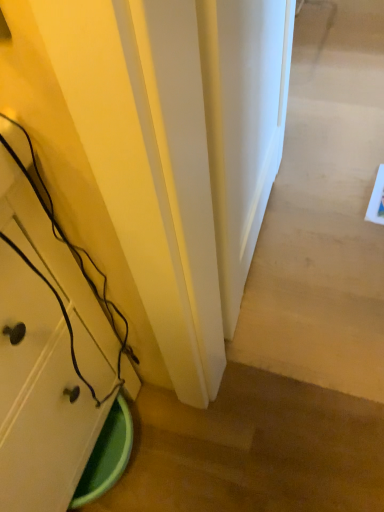
I want to click on free spot to the right of white smooth door at center, so click(345, 188).